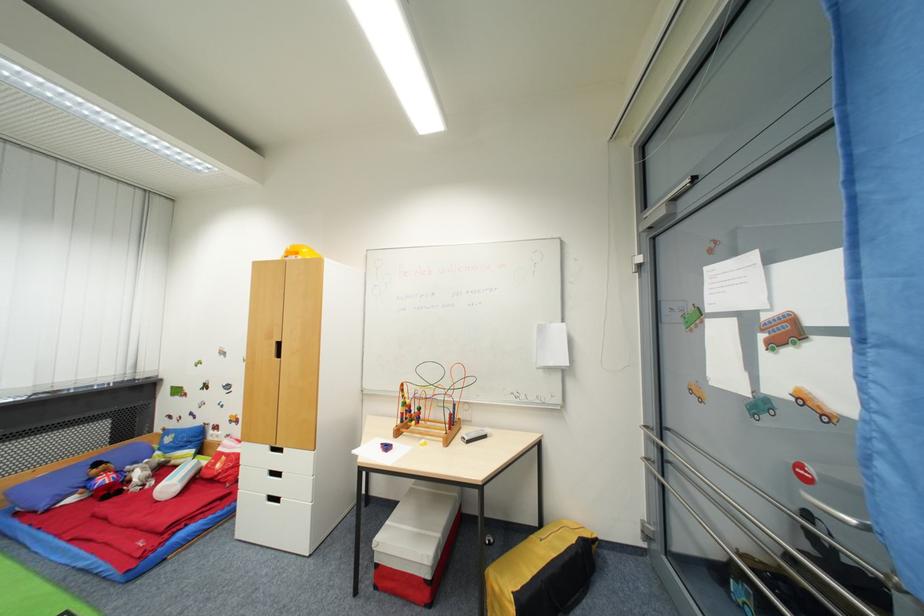
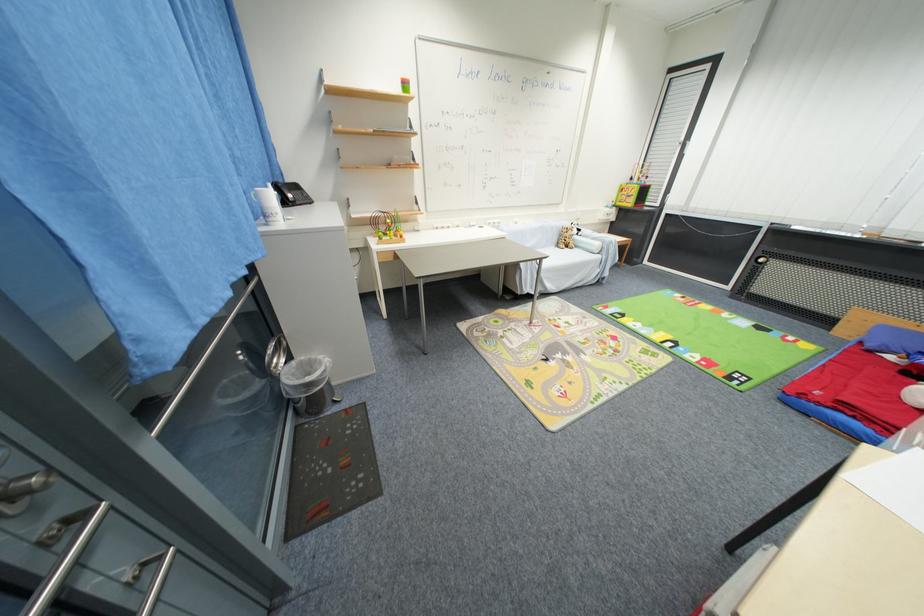
The point at (167,545) is marked in the first image. Where is the corresponding point in the second image?

(824, 406)